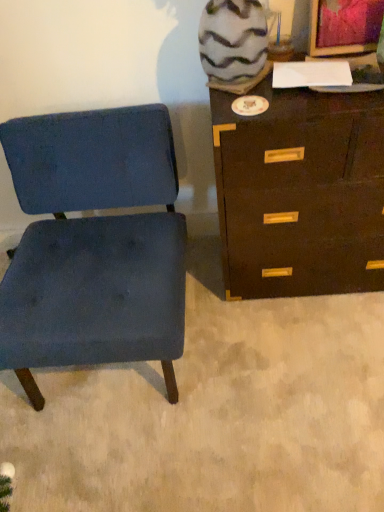
Question: From their relative heights in the image, would you say dark brown wood chest of drawers at right is taller or shorter than blue fabric chair at left?

Choices:
 (A) tall
 (B) short

Answer: (A)

Question: Is dark brown wood chest of drawers at right in front of or behind blue fabric chair at left in the image?

Choices:
 (A) behind
 (B) front

Answer: (A)

Question: Based on their sizes in the image, would you say dark brown wood chest of drawers at right is bigger or smaller than blue fabric chair at left?

Choices:
 (A) big
 (B) small

Answer: (B)

Question: Looking at the image, does blue fabric chair at left seem bigger or smaller compared to dark brown wood chest of drawers at right?

Choices:
 (A) small
 (B) big

Answer: (B)

Question: Would you say blue fabric chair at left is to the left or to the right of dark brown wood chest of drawers at right in the picture?

Choices:
 (A) left
 (B) right

Answer: (A)

Question: In terms of width, does blue fabric chair at left look wider or thinner when compared to dark brown wood chest of drawers at right?

Choices:
 (A) thin
 (B) wide

Answer: (B)

Question: From a real-world perspective, is blue fabric chair at left positioned above or below dark brown wood chest of drawers at right?

Choices:
 (A) above
 (B) below

Answer: (B)